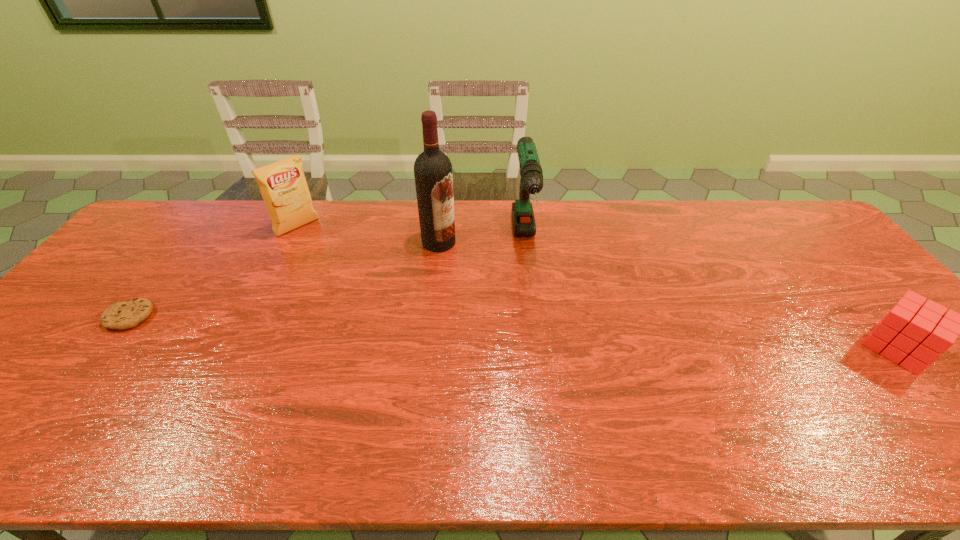
You are a GUI agent. You are given a task and a screenshot of the screen. Output one action in this format:
    pyautogui.click(x=<x>, y=<y>)
    Task: Click on the free location located on the back of the shortest object
    The height and width of the screenshot is (540, 960).
    Given the screenshot: What is the action you would take?
    pyautogui.click(x=156, y=281)

Where is `vacant region located on the left of the second shortest object`? Image resolution: width=960 pixels, height=540 pixels. vacant region located on the left of the second shortest object is located at coordinates (763, 348).

Identify the location of free space located 0.220m on the handle side of the fourth object from left to right. The width and height of the screenshot is (960, 540). (539, 337).

What are the coordinates of `blank space located on the handle side of the fourth object from left to right` in the screenshot? It's located at (531, 290).

Where is `vacant area situated on the handle side of the fourth object from left to right`? vacant area situated on the handle side of the fourth object from left to right is located at coordinates (542, 363).

At what (x,y) coordinates should I click in order to perform the action: click on vacant space located on the label of the wine bottle. Please return your answer as a coordinate pair (x, y). Looking at the image, I should click on (510, 303).

Identify the location of blank area located on the label of the wine bottle. Image resolution: width=960 pixels, height=540 pixels. (500, 295).

At what (x,y) coordinates should I click in order to perform the action: click on free space located on the label of the wine bottle. Please return your answer as a coordinate pair (x, y). The image size is (960, 540). Looking at the image, I should click on (489, 286).

I want to click on vacant area located 0.270m on the front of the crisp (potato chip) with the logo, so click(351, 278).

Find the location of a particular element. The height and width of the screenshot is (540, 960). blank space located on the front of the crisp (potato chip) with the logo is located at coordinates (372, 297).